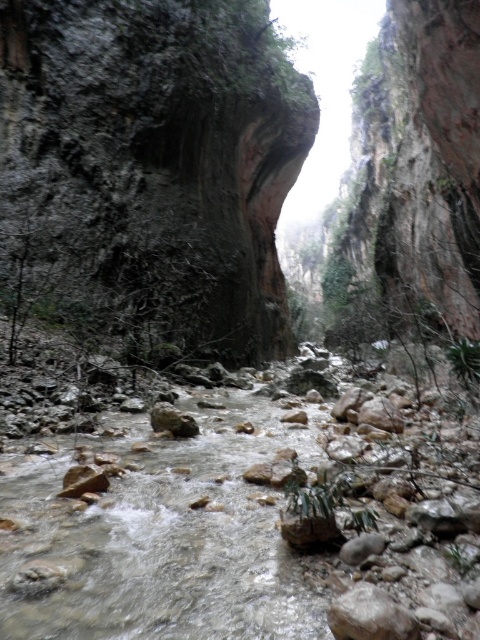
You are hiking through the canyon and come across the white rocky stream at center. Based on the coordinates provided, can you determine if the stream is closer to the left or right side of the canyon?

The white rocky stream at center is located at point 0.839 on the x and 0.335 on the y. Since the x coordinate is closer to 1, the stream is closer to the right side of the canyon.

You are a hiker trying to cross the canyon floor. You see the dark gray rock face at upper center and the smooth gray rock at center. Which path should you choose to avoid the wider obstacle?

The dark gray rock face at upper center might be wider than the smooth gray rock at center, so to avoid the wider obstacle, you should choose the path around the smooth gray rock at center.

You are standing at the entrance of the canyon and want to locate the dark gray rock face at upper center. According to the coordinates given, where should you look relative to the center of the image?

The dark gray rock face at upper center is located at coordinates 0.269 on the x axis and 0.312 on the y axis, so you should look slightly to the left and above the center of the image.